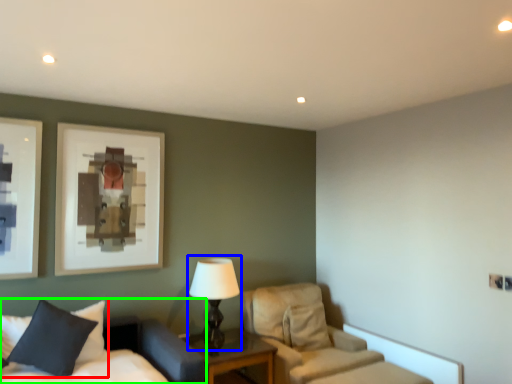
Question: Which object is positioned closest to pillow (highlighted by a red box)? Select from table lamp (highlighted by a blue box) and bed (highlighted by a green box).

Choices:
 (A) table lamp
 (B) bed

Answer: (B)